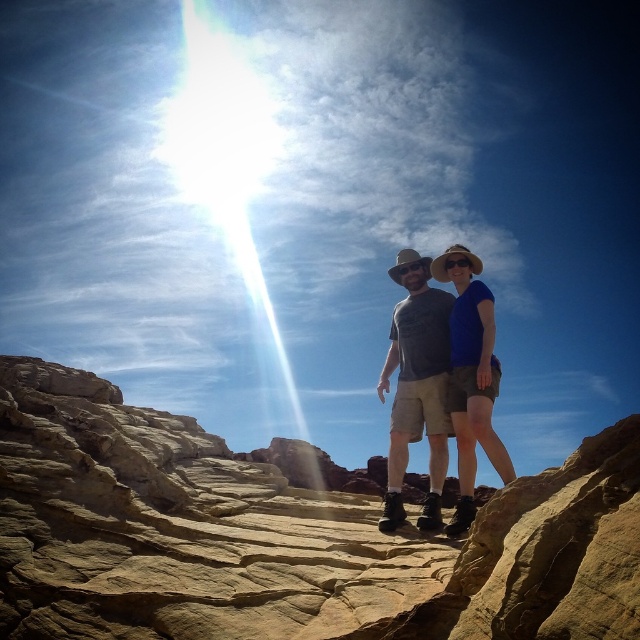
Question: Does matte gray shirt at center appear under blue fabric shirt at center?

Choices:
 (A) yes
 (B) no

Answer: (A)

Question: Is blue fabric shirt at center to the left of beige woven cowboy hat at upper right from the viewer's perspective?

Choices:
 (A) yes
 (B) no

Answer: (A)

Question: Which of the following is the closest to the observer?

Choices:
 (A) (436, 260)
 (B) (429, 291)
 (C) (460, 268)

Answer: (C)

Question: Which point is closer to the camera?

Choices:
 (A) coord(440,278)
 (B) coord(440,301)

Answer: (B)

Question: Observing the image, what is the correct spatial positioning of matte gray shirt at center in reference to blue fabric shirt at center?

Choices:
 (A) right
 (B) left

Answer: (B)

Question: Estimate the real-world distances between objects in this image. Which object is closer to the matte gray shirt at center?

Choices:
 (A) beige woven cowboy hat at upper right
 (B) blue fabric shirt at center

Answer: (B)